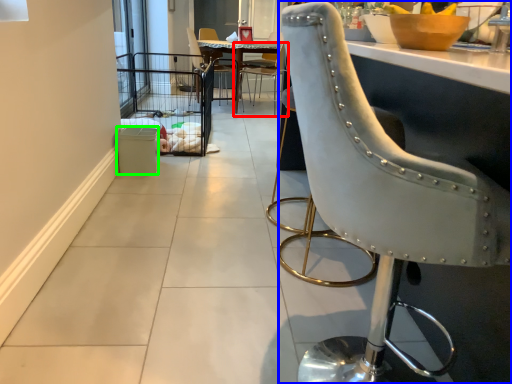
Question: Which is farther away from chair (highlighted by a red box)? chair (highlighted by a blue box) or trash bin/can (highlighted by a green box)?

Choices:
 (A) chair
 (B) trash bin/can

Answer: (A)